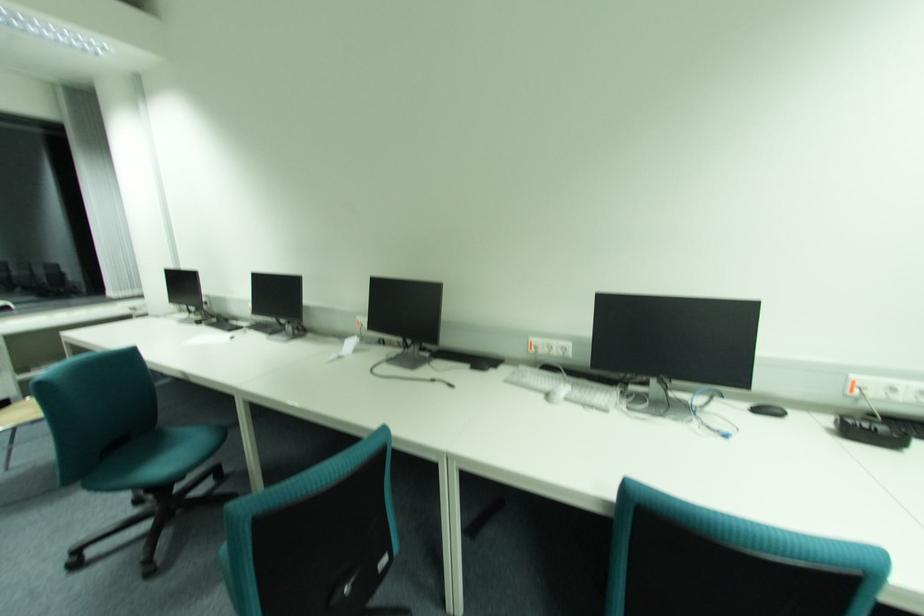
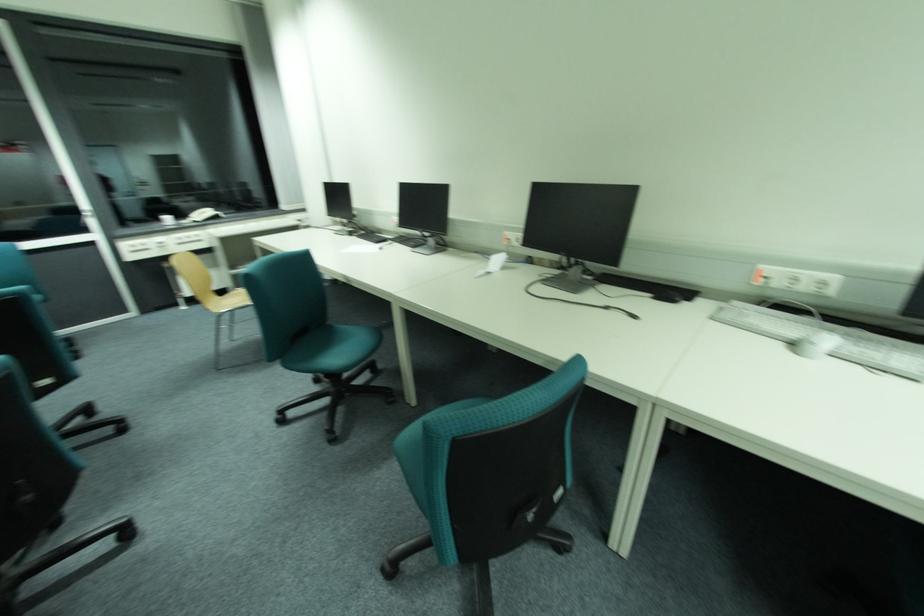
The point at (84, 484) is marked in the first image. Where is the corresponding point in the second image?

(285, 361)